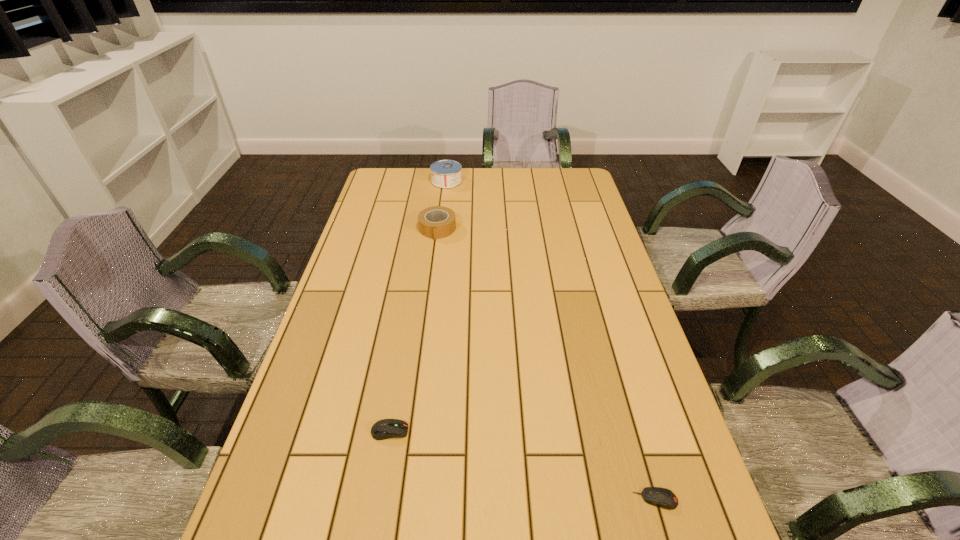
This screenshot has height=540, width=960. I want to click on free space between the nearer computer mouse and the can, so click(x=551, y=340).

Identify the location of free spot between the shorter computer mouse and the third nearest object. (546, 364).

Where is `vacant area that lies between the farthest object and the left computer mouse`? vacant area that lies between the farthest object and the left computer mouse is located at coordinates (419, 306).

Where is `unoccupied position between the farther computer mouse and the rightmost object`? This screenshot has height=540, width=960. unoccupied position between the farther computer mouse and the rightmost object is located at coordinates (522, 465).

Find the location of a particular element. blank region between the shortest object and the tallest object is located at coordinates (551, 340).

Identify the location of free area in between the rightmost object and the duct tape. (546, 364).

Where is `vacant space that is in between the third nearest object and the farthest object`? This screenshot has width=960, height=540. vacant space that is in between the third nearest object and the farthest object is located at coordinates (442, 205).

In order to click on vacant point located between the second nearest object and the farthest object in this screenshot , I will do point(419,306).

The image size is (960, 540). I want to click on object that is the second nearest to the farther computer mouse, so click(x=435, y=222).

Locate which object is the closest to the rightmost object. Please provide its 2D coordinates. Your answer should be formatted as a tuple, i.e. [(x, y)], where the tuple contains the x and y coordinates of a point satisfying the conditions above.

[(383, 429)]